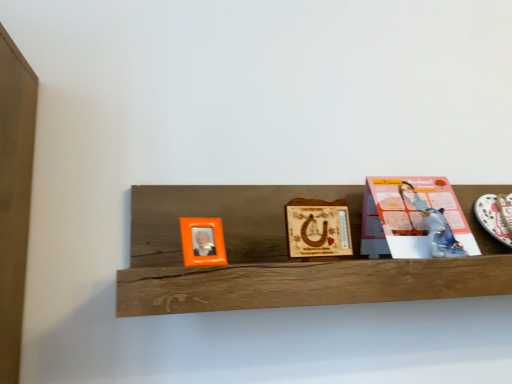
This screenshot has height=384, width=512. I want to click on pink paper at right, so click(420, 217).

This screenshot has width=512, height=384. Describe the element at coordinates (284, 256) in the screenshot. I see `wooden shelf at center` at that location.

I want to click on white glossy platter at right, so click(x=496, y=216).

Consider the image. Is wooden shelf at center not inside metallic blue cat at upper right?

wooden shelf at center is positioned outside metallic blue cat at upper right.

Considering the relative positions of wooden shelf at center and metallic blue cat at upper right in the image provided, is wooden shelf at center to the right of metallic blue cat at upper right from the viewer's perspective?

In fact, wooden shelf at center is to the left of metallic blue cat at upper right.

From the image's perspective, relative to metallic blue cat at upper right, is wooden shelf at center above or below?

Based on their image positions, wooden shelf at center is located beneath metallic blue cat at upper right.

Identify the location of shelf below the metallic blue cat at upper right (from the image's perspective). The height and width of the screenshot is (384, 512). (284, 256).

From a real-world perspective, which is physically above, metallic blue cat at upper right or orange plastic picture frame at left, which appears as the first picture frame when viewed from the left?

metallic blue cat at upper right, from a real-world perspective.

Does metallic blue cat at upper right contain orange plastic picture frame at left, which is the second picture frame from right to left?

Definitely not — orange plastic picture frame at left, which is the second picture frame from right to left, is not inside metallic blue cat at upper right.

Measure the distance between metallic blue cat at upper right and orange plastic picture frame at left, which appears as the first picture frame when viewed from the left.

metallic blue cat at upper right and orange plastic picture frame at left, which appears as the first picture frame when viewed from the left, are 37.20 centimeters apart.

Is metallic blue cat at upper right in contact with pink paper at right?

Yes.

From their relative heights in the image, would you say metallic blue cat at upper right is taller or shorter than pink paper at right?

metallic blue cat at upper right is shorter than pink paper at right.

In the scene shown: Is metallic blue cat at upper right in front of or behind pink paper at right in the image?

Visually, metallic blue cat at upper right is located in front of pink paper at right.

Can you tell me how much metallic blue cat at upper right and pink paper at right differ in facing direction?

The angular difference between metallic blue cat at upper right and pink paper at right is 0.604 degrees.

Considering the relative sizes of orange plastic picture frame at left, which appears as the first picture frame when viewed from the left, and wooden plaque with horseshoe at center, which is the 1th picture frame from right to left, in the image provided, is orange plastic picture frame at left, which appears as the first picture frame when viewed from the left, smaller than wooden plaque with horseshoe at center, which is the 1th picture frame from right to left,?

Yes.

Which object is wider, orange plastic picture frame at left, which is the second picture frame from right to left, or wooden plaque with horseshoe at center, marked as the second picture frame in a left-to-right arrangement?

With larger width is orange plastic picture frame at left, which is the second picture frame from right to left.

Could you tell me if orange plastic picture frame at left, which appears as the first picture frame when viewed from the left, is facing wooden plaque with horseshoe at center, marked as the second picture frame in a left-to-right arrangement?

No, orange plastic picture frame at left, which appears as the first picture frame when viewed from the left, does not turn towards wooden plaque with horseshoe at center, marked as the second picture frame in a left-to-right arrangement.

Consider the image. Considering the sizes of objects orange plastic picture frame at left, which appears as the first picture frame when viewed from the left, and wooden plaque with horseshoe at center, which is the 1th picture frame from right to left, in the image provided, who is taller, orange plastic picture frame at left, which appears as the first picture frame when viewed from the left, or wooden plaque with horseshoe at center, which is the 1th picture frame from right to left,?

Standing taller between the two is wooden plaque with horseshoe at center, which is the 1th picture frame from right to left.

From the picture: Between wooden shelf at center and orange plastic picture frame at left, which appears as the first picture frame when viewed from the left, which one appears on the left side from the viewer's perspective?

orange plastic picture frame at left, which appears as the first picture frame when viewed from the left.

Image resolution: width=512 pixels, height=384 pixels. In order to click on the 1st picture frame behind the wooden shelf at center in this screenshot , I will do `click(202, 241)`.

Is wooden shelf at center situated inside orange plastic picture frame at left, which is the second picture frame from right to left, or outside?

wooden shelf at center is not inside orange plastic picture frame at left, which is the second picture frame from right to left, it's outside.

From the image's perspective, would you say wooden shelf at center is shown under orange plastic picture frame at left, which appears as the first picture frame when viewed from the left?

Actually, wooden shelf at center appears above orange plastic picture frame at left, which appears as the first picture frame when viewed from the left, in the image.

Is white glossy platter at right at the left side of metallic blue cat at upper right?

In fact, white glossy platter at right is to the right of metallic blue cat at upper right.

Is white glossy platter at right not close to metallic blue cat at upper right?

No, there isn't a large distance between white glossy platter at right and metallic blue cat at upper right.

From a real-world perspective, is white glossy platter at right located beneath metallic blue cat at upper right?

No.

Does wooden shelf at center lie behind wooden plaque with horseshoe at center, which is the 1th picture frame from right to left?

No, it is not.

Is wooden shelf at center far away from wooden plaque with horseshoe at center, which is the 1th picture frame from right to left?

Actually, wooden shelf at center and wooden plaque with horseshoe at center, which is the 1th picture frame from right to left, are a little close together.

Can you confirm if wooden shelf at center is shorter than wooden plaque with horseshoe at center, marked as the second picture frame in a left-to-right arrangement?

No.

Locate an element on the screen. This screenshot has width=512, height=384. toy beneath the wooden shelf at center (from a real-world perspective) is located at coordinates (440, 233).

Where is `toy that is above the orange plastic picture frame at left, which is the second picture frame from right to left (from the image's perspective)`? The height and width of the screenshot is (384, 512). toy that is above the orange plastic picture frame at left, which is the second picture frame from right to left (from the image's perspective) is located at coordinates (440, 233).

Consider the image. From the image, which object appears to be farther from pink paper at right, orange plastic picture frame at left, which appears as the first picture frame when viewed from the left, or wooden shelf at center?

orange plastic picture frame at left, which appears as the first picture frame when viewed from the left, lies further to pink paper at right than the other object.

From the image, which object appears to be farther from wooden plaque with horseshoe at center, which is the 1th picture frame from right to left, wooden shelf at center or metallic blue cat at upper right?

metallic blue cat at upper right lies further to wooden plaque with horseshoe at center, which is the 1th picture frame from right to left, than the other object.

Which object lies further to the anchor point wooden plaque with horseshoe at center, which is the 1th picture frame from right to left, metallic blue cat at upper right or orange plastic picture frame at left, which appears as the first picture frame when viewed from the left?

The object further to wooden plaque with horseshoe at center, which is the 1th picture frame from right to left, is metallic blue cat at upper right.

Based on their spatial positions, is white glossy platter at right or wooden plaque with horseshoe at center, marked as the second picture frame in a left-to-right arrangement, further from orange plastic picture frame at left, which is the second picture frame from right to left?

Among the two, white glossy platter at right is located further to orange plastic picture frame at left, which is the second picture frame from right to left.

In the scene shown: Considering their positions, is metallic blue cat at upper right positioned closer to white glossy platter at right than orange plastic picture frame at left, which is the second picture frame from right to left?

metallic blue cat at upper right.

Considering their positions, is orange plastic picture frame at left, which is the second picture frame from right to left, positioned further to white glossy platter at right than metallic blue cat at upper right?

orange plastic picture frame at left, which is the second picture frame from right to left, is positioned further to the anchor white glossy platter at right.

When comparing their distances from pink paper at right, does wooden shelf at center or white glossy platter at right seem further?

white glossy platter at right is further to pink paper at right.

In the scene shown: Based on their spatial positions, is wooden plaque with horseshoe at center, which is the 1th picture frame from right to left, or pink paper at right further from white glossy platter at right?

wooden plaque with horseshoe at center, which is the 1th picture frame from right to left, is further to white glossy platter at right.

Find the location of a particular element. This screenshot has width=512, height=384. shelf between wooden plaque with horseshoe at center, marked as the second picture frame in a left-to-right arrangement, and white glossy platter at right from left to right is located at coordinates (284, 256).

I want to click on shelf situated between wooden plaque with horseshoe at center, which is the 1th picture frame from right to left, and pink paper at right from left to right, so [284, 256].

Find the location of a particular element. Image resolution: width=512 pixels, height=384 pixels. toy between wooden shelf at center and pink paper at right from front to back is located at coordinates (440, 233).

The image size is (512, 384). I want to click on paperback book located between wooden plaque with horseshoe at center, marked as the second picture frame in a left-to-right arrangement, and white glossy platter at right in the left-right direction, so click(x=420, y=217).